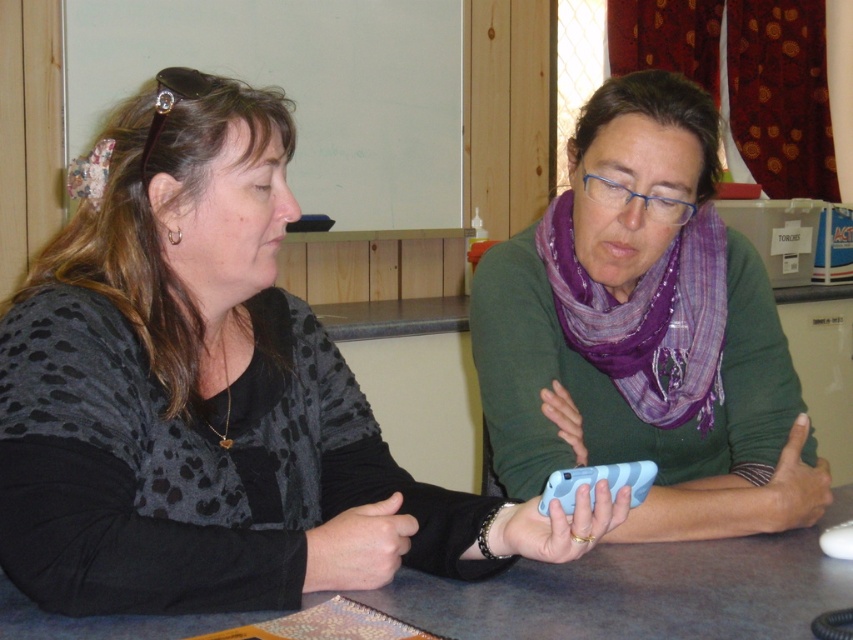
Locate an element on the screen. matte black sweater at center is located at coordinates (212, 397).

Looking at this image, does matte black sweater at center have a larger size compared to purple scarf at center?

Yes.

Where is `matte black sweater at center`? The image size is (853, 640). matte black sweater at center is located at coordinates (212, 397).

Who is shorter, matte black sweater at center or blue plastic phone at center?

blue plastic phone at center is shorter.

How far apart are matte black sweater at center and blue plastic phone at center?

The distance of matte black sweater at center from blue plastic phone at center is 8.55 inches.

Is point (534, 557) in front of point (837, 509)?

That is True.

Locate an element on the screen. The height and width of the screenshot is (640, 853). matte black sweater at center is located at coordinates (212, 397).

In the scene shown: Between purple scarf at center and blue plastic phone at center, which one is positioned higher?

purple scarf at center

How distant is purple scarf at center from blue plastic phone at center?

purple scarf at center is 11.44 inches away from blue plastic phone at center.

The width and height of the screenshot is (853, 640). Describe the element at coordinates (645, 330) in the screenshot. I see `purple scarf at center` at that location.

The image size is (853, 640). In order to click on purple scarf at center in this screenshot , I will do `click(645, 330)`.